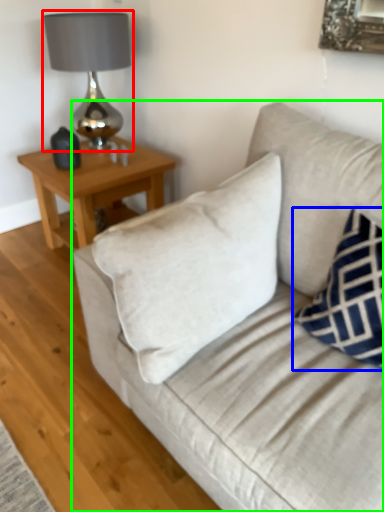
Question: Which object is positioned farthest from table lamp (highlighted by a red box)? Select from pillow (highlighted by a blue box) and studio couch (highlighted by a green box).

Choices:
 (A) pillow
 (B) studio couch

Answer: (A)